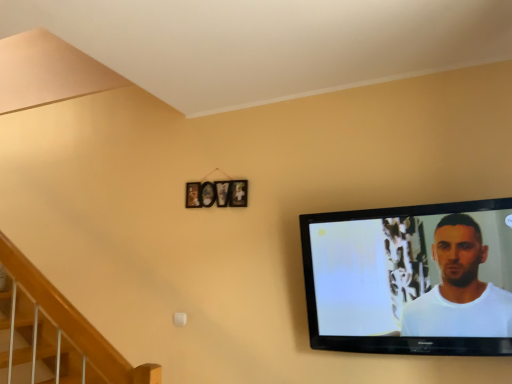
Question: Would you consider black glossy tv at right to be distant from wooden picture frame at center?

Choices:
 (A) no
 (B) yes

Answer: (A)

Question: Is black glossy tv at right at the right side of wooden picture frame at center?

Choices:
 (A) no
 (B) yes

Answer: (B)

Question: Is wooden picture frame at center completely or partially inside black glossy tv at right?

Choices:
 (A) no
 (B) yes

Answer: (A)

Question: Does black glossy tv at right touch wooden picture frame at center?

Choices:
 (A) yes
 (B) no

Answer: (B)

Question: Considering the relative positions of black glossy tv at right and wooden picture frame at center in the image provided, is black glossy tv at right in front of wooden picture frame at center?

Choices:
 (A) no
 (B) yes

Answer: (B)

Question: Is black glossy tv at right bigger than wooden picture frame at center?

Choices:
 (A) yes
 (B) no

Answer: (A)

Question: From a real-world perspective, is wooden picture frame at center beneath black glossy tv at right?

Choices:
 (A) yes
 (B) no

Answer: (B)

Question: Would you consider wooden picture frame at center to be distant from black glossy tv at right?

Choices:
 (A) no
 (B) yes

Answer: (A)

Question: Is wooden picture frame at center closer to camera compared to black glossy tv at right?

Choices:
 (A) no
 (B) yes

Answer: (A)

Question: Is wooden picture frame at center directly adjacent to black glossy tv at right?

Choices:
 (A) yes
 (B) no

Answer: (B)

Question: Is wooden picture frame at center looking in the opposite direction of black glossy tv at right?

Choices:
 (A) yes
 (B) no

Answer: (B)

Question: Does wooden picture frame at center lie behind black glossy tv at right?

Choices:
 (A) yes
 (B) no

Answer: (A)

Question: Looking at their shapes, would you say wooden picture frame at center is wider or thinner than black glossy tv at right?

Choices:
 (A) wide
 (B) thin

Answer: (B)